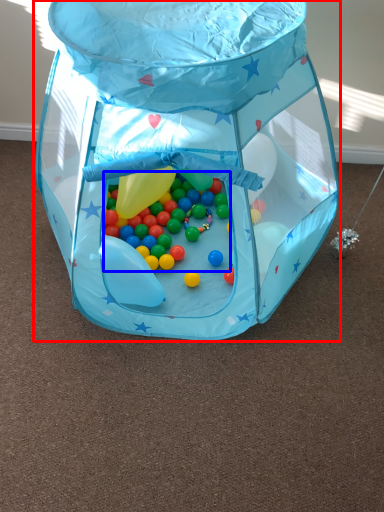
Question: Which point is further to the camera, toy (highlighted by a red box) or candy (highlighted by a blue box)?

Choices:
 (A) toy
 (B) candy

Answer: (B)